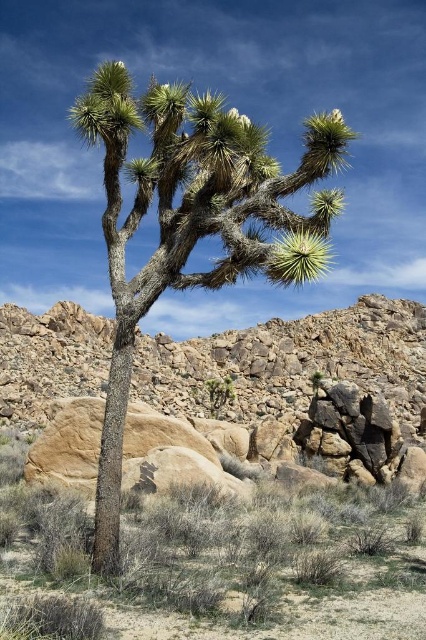
You are standing in the desert and see the brown textured rock at center and the green spiky tree at center. Which object is nearer to you?

The brown textured rock at center is closer to the viewer than the green spiky tree at center.

You are a hiker in the desert and want to take a photo of both the brown textured rock at center and the green spiky tree at center. Which object should you focus on first to ensure both are in frame?

You should focus on the green spiky tree at center first because it is larger than the brown textured rock at center, so you can adjust the camera to include both.

You are a desert explorer who needs to set up a tent. You have two options for the location of your tent. One is near the brown textured rock at center, and the other is under the green spiky tree at center. Based on the scene description, which location would provide better shade during the hottest part of the day?

The green spiky tree at center would provide better shade during the hottest part of the day because the brown textured rock at center is positioned under it, indicating the tree casts a larger shadow over the rock.